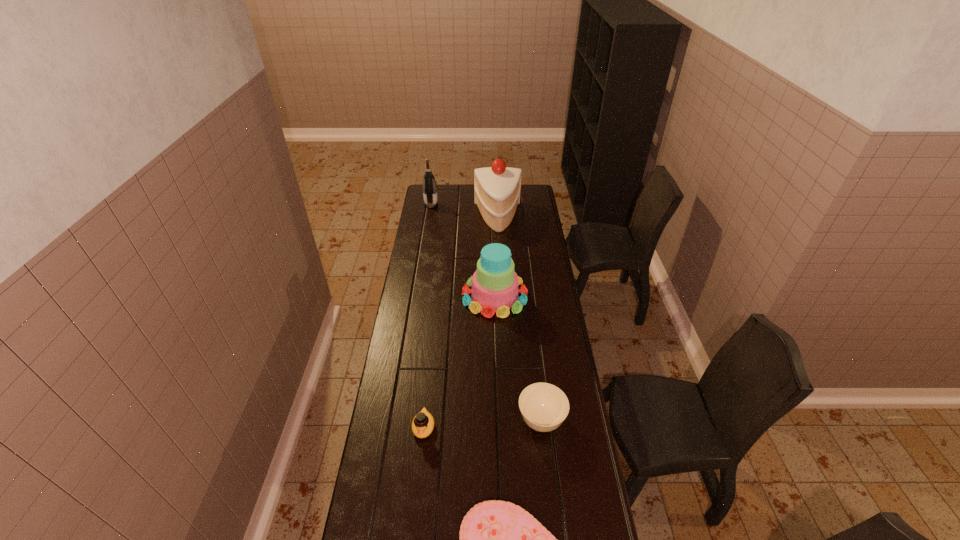
The image size is (960, 540). In the image, there is a desktop. In order to click on free space at the right edge in this screenshot , I will do `click(542, 305)`.

What are the coordinates of `blank space at the far left corner` in the screenshot? It's located at (444, 202).

Image resolution: width=960 pixels, height=540 pixels. I want to click on empty space that is in between the leftmost object and the fifth object from right to left, so click(427, 316).

Image resolution: width=960 pixels, height=540 pixels. I want to click on free space between the duck and the sugar bowl, so click(x=482, y=424).

At what (x,y) coordinates should I click in order to perform the action: click on free space between the farthest cake and the wine bottle. Please return your answer as a coordinate pair (x, y). This screenshot has width=960, height=540. Looking at the image, I should click on (465, 211).

Find the location of a particular element. The width and height of the screenshot is (960, 540). free point between the fourth nearest object and the wine bottle is located at coordinates (463, 251).

Identify which object is located as the second nearest to the farthest cake. Please provide its 2D coordinates. Your answer should be formatted as a tuple, i.e. [(x, y)], where the tuple contains the x and y coordinates of a point satisfying the conditions above.

[(494, 284)]

This screenshot has width=960, height=540. I want to click on the fourth closest object to the fifth object from right to left, so click(x=497, y=189).

Point out which cake is positioned as the nearest to the third farthest object. Please provide its 2D coordinates. Your answer should be formatted as a tuple, i.e. [(x, y)], where the tuple contains the x and y coordinates of a point satisfying the conditions above.

[(497, 189)]

Locate an element on the screen. cake that stands as the closest to the tallest cake is located at coordinates (494, 284).